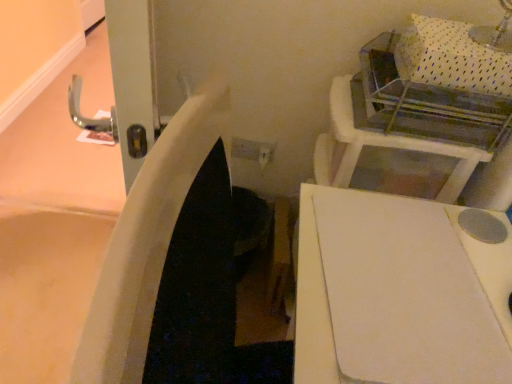
Describe the element at coordinates (392, 145) in the screenshot. I see `white plastic vanity at upper right` at that location.

You are a GUI agent. You are given a task and a screenshot of the screen. Output one action in this format:
    pyautogui.click(x=<x>, y=<y>)
    Task: Click on the white plastic vanity at upper right
    The height and width of the screenshot is (384, 512).
    Given the screenshot: What is the action you would take?
    pyautogui.click(x=392, y=145)

What do you see at coordinates (398, 293) in the screenshot? I see `white matte cutting board at center` at bounding box center [398, 293].

Find the location of a particular element. white matte cutting board at center is located at coordinates (398, 293).

Find the location of a particular element. This screenshot has width=512, height=384. white plastic vanity at upper right is located at coordinates (392, 145).

Does white matte cutting board at center appear on the left side of white plastic vanity at upper right?

Yes.

Between white matte cutting board at center and white plastic vanity at upper right, which one is positioned in front?

white matte cutting board at center is closer to the camera.

Which is more distant, (489, 280) or (347, 109)?

Point (347, 109)

From the image's perspective, does white matte cutting board at center appear higher than white plastic vanity at upper right?

No.

From a real-world perspective, who is located higher, white matte cutting board at center or white plastic vanity at upper right?

From a 3D spatial view, white matte cutting board at center is above.

Which of these two, white matte cutting board at center or white plastic vanity at upper right, is wider?

Wider between the two is white plastic vanity at upper right.

Can you confirm if white matte cutting board at center is shorter than white plastic vanity at upper right?

Yes.

Is white matte cutting board at center bigger or smaller than white plastic vanity at upper right?

Considering their sizes, white matte cutting board at center takes up less space than white plastic vanity at upper right.

Is white matte cutting board at center surrounding white plastic vanity at upper right?

No, white plastic vanity at upper right is located outside of white matte cutting board at center.

Is white matte cutting board at center in contact with white plastic vanity at upper right?

No, white matte cutting board at center is not touching white plastic vanity at upper right.

Is white matte cutting board at center turned away from white plastic vanity at upper right?

white matte cutting board at center is not turned away from white plastic vanity at upper right.

This screenshot has height=384, width=512. In order to click on furniture that appears above the white plastic vanity at upper right (from a real-world perspective) in this screenshot , I will do `click(398, 293)`.

Is white plastic vanity at upper right at the left side of white matte cutting board at center?

In fact, white plastic vanity at upper right is to the right of white matte cutting board at center.

Considering the positions of objects white plastic vanity at upper right and white matte cutting board at center in the image provided, who is in front, white plastic vanity at upper right or white matte cutting board at center?

white matte cutting board at center.

Between point (476, 158) and point (308, 209), which one is positioned in front?

The point (308, 209) is closer to the camera.

From the image's perspective, which object appears higher, white plastic vanity at upper right or white matte cutting board at center?

white plastic vanity at upper right is shown above in the image.

From a real-world perspective, who is located lower, white plastic vanity at upper right or white matte cutting board at center?

From a 3D spatial view, white plastic vanity at upper right is below.

Which object is thinner, white plastic vanity at upper right or white matte cutting board at center?

white matte cutting board at center.

In the scene shown: Can you confirm if white plastic vanity at upper right is shorter than white matte cutting board at center?

Incorrect, the height of white plastic vanity at upper right does not fall short of that of white matte cutting board at center.

Is white plastic vanity at upper right bigger or smaller than white matte cutting board at center?

white plastic vanity at upper right is bigger than white matte cutting board at center.

Is white matte cutting board at center inside white plastic vanity at upper right?

That's incorrect, white matte cutting board at center is not inside white plastic vanity at upper right.

Is white plastic vanity at upper right beside white matte cutting board at center?

They are not placed beside each other.

Is white plastic vanity at upper right oriented towards white matte cutting board at center?

No, white plastic vanity at upper right is not turned towards white matte cutting board at center.

How different are the orientations of white plastic vanity at upper right and white matte cutting board at center in degrees?

They differ by 6.14 degrees in their facing directions.

Find the location of `furniture lying in front of the white plastic vanity at upper right`. furniture lying in front of the white plastic vanity at upper right is located at coordinates (398, 293).

There is a white plastic vanity at upper right. Where is `furniture above it (from a real-world perspective)`? furniture above it (from a real-world perspective) is located at coordinates (398, 293).

Where is `vanity behind the white matte cutting board at center`? This screenshot has width=512, height=384. vanity behind the white matte cutting board at center is located at coordinates click(x=392, y=145).